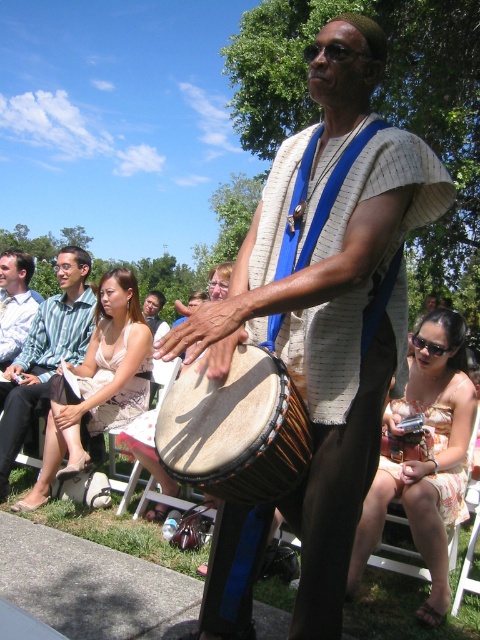
You are a photographer trying to capture a closeup of both the natural wood drum at center and the matte white dress at center. Since you want both to be in focus, you need to ensure they are within the same focal range. Given their sizes, which object should you adjust your camera settings to prioritize focusing on first to ensure both are sharp?

The natural wood drum at center is smaller in width than the matte white dress at center. To ensure both are in focus, prioritize focusing on the natural wood drum at center first since its smaller size requires a narrower depth of field adjustment, allowing the larger matte white dress at center to fall within the same focal plane.

You are standing in front of the scene and want to locate the matte brown drum at center. What are its coordinates?

The matte brown drum at center is located at coordinates point [330,296].

You are standing in the scene and want to move from point A to point B. Point A is at coordinates point (x=299, y=192) and point B is at coordinates point (x=73, y=304). Which point is closer to you?

Point (x=299, y=192) is closer to the viewer than point (x=73, y=304).